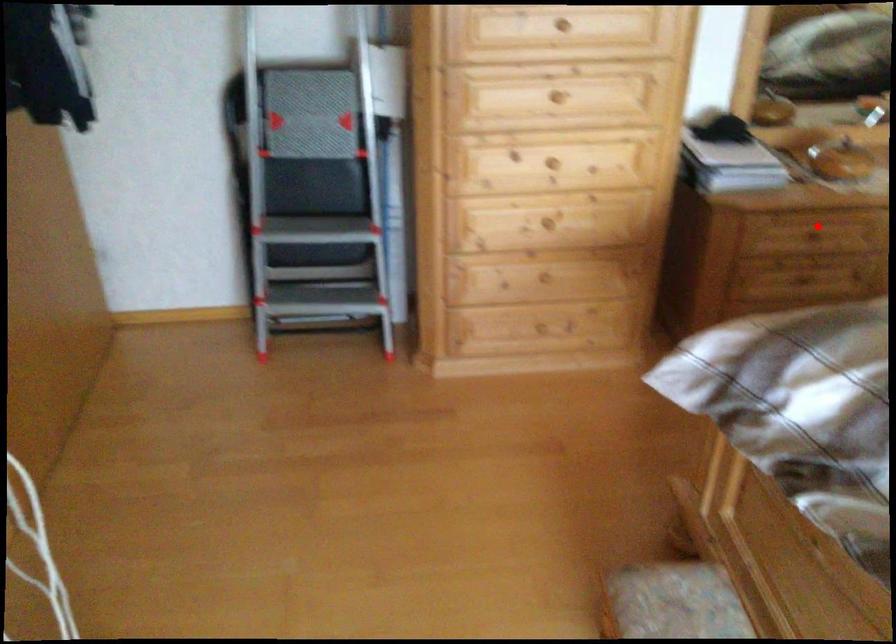
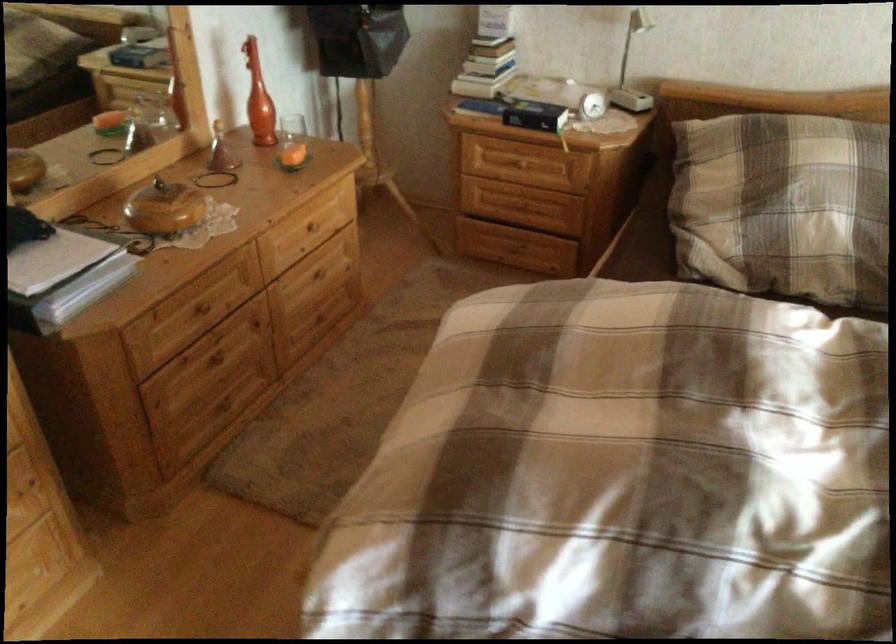
Question: I am providing you with two images of the same scene from different viewpoints. In image1, a red point is highlighted. Considering the same 3D point in image2, which of the following is correct?

Choices:
 (A) It is closer
 (B) It is farther

Answer: (A)